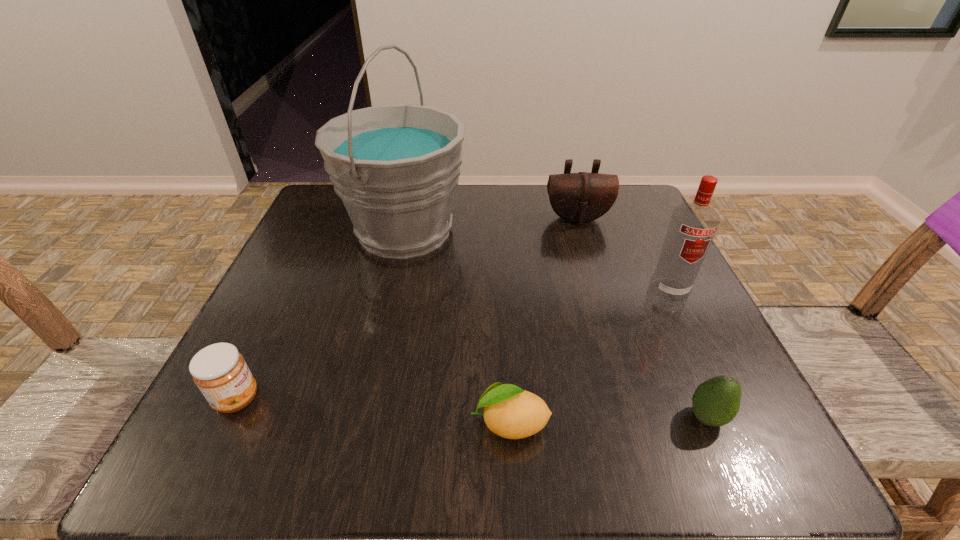
Identify the location of the fifth object from right to left. The height and width of the screenshot is (540, 960). (395, 167).

Identify the location of the tallest object. This screenshot has width=960, height=540. (395, 167).

This screenshot has width=960, height=540. What are the coordinates of `vodka` in the screenshot? It's located at (692, 227).

I want to click on the third farthest object, so click(692, 227).

Identify the location of pouch. This screenshot has width=960, height=540. (582, 197).

Where is `the leftmost object`? This screenshot has height=540, width=960. the leftmost object is located at coordinates (220, 372).

Identify the location of avocado. (715, 402).

I want to click on the third object from left to right, so click(x=510, y=412).

Where is `the shortest object`? This screenshot has height=540, width=960. the shortest object is located at coordinates (510, 412).

You are a GUI agent. You are given a task and a screenshot of the screen. Output one action in this format:
    pyautogui.click(x=<x>, y=<y>)
    Task: Click on the vacant space located on the front of the fifth object from right to left
    This screenshot has width=960, height=540.
    Given the screenshot: What is the action you would take?
    pyautogui.click(x=389, y=301)